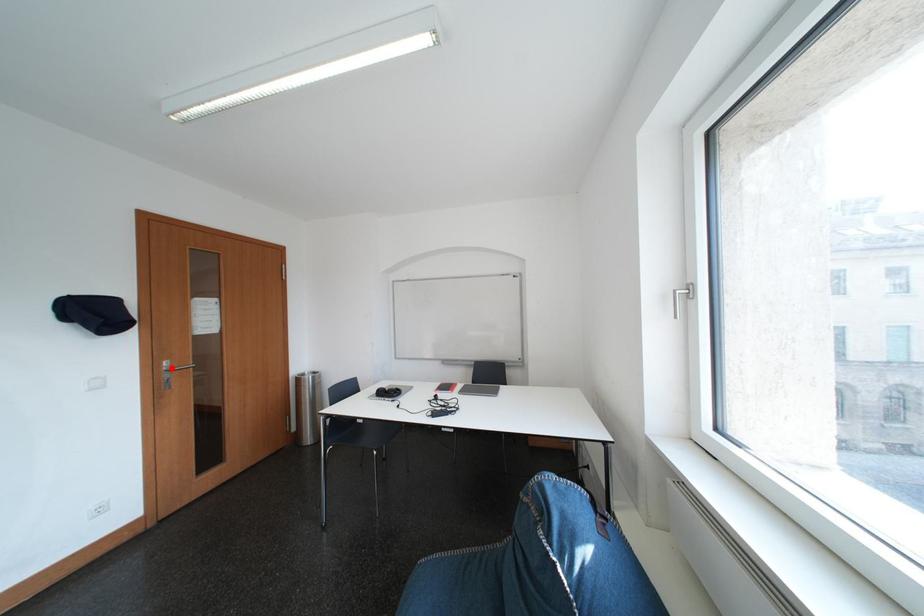
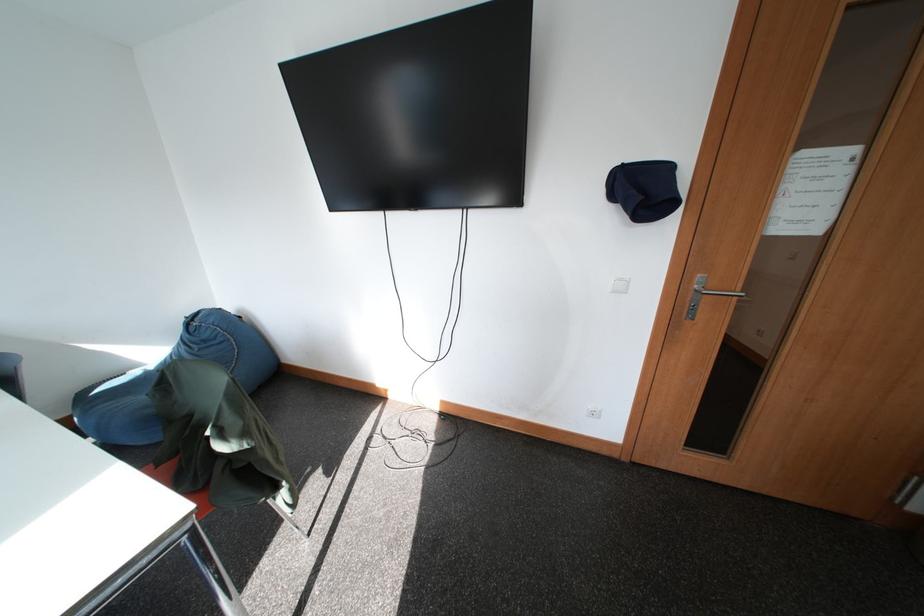
Where in the second image is the point corresponding to the highlighted location from the first image?

(703, 282)